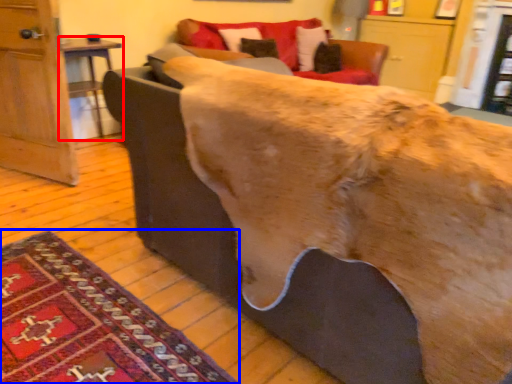
Question: Which object appears farthest to the camera in this image, table (highlighted by a red box) or mat (highlighted by a blue box)?

Choices:
 (A) table
 (B) mat

Answer: (A)